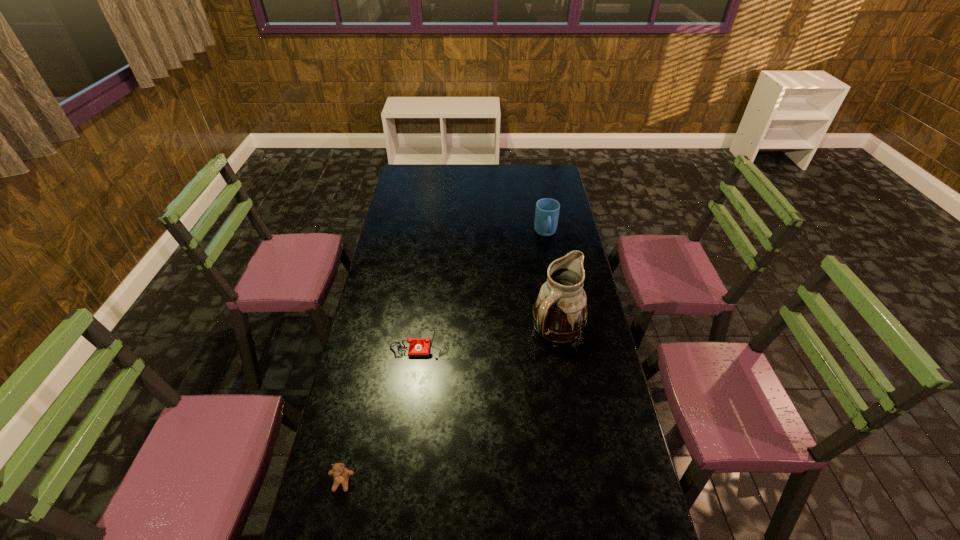
Image resolution: width=960 pixels, height=540 pixels. Find the location of `pitcher`. pitcher is located at coordinates (560, 312).

Locate an element on the screen. The image size is (960, 540). the second tallest object is located at coordinates (547, 210).

The width and height of the screenshot is (960, 540). I want to click on the farthest object, so click(x=547, y=210).

What are the coordinates of `teddy bear` in the screenshot? It's located at (341, 475).

You are a GUI agent. You are given a task and a screenshot of the screen. Output one action in this format:
    pyautogui.click(x=<x>, y=<y>)
    Task: Click on the leftmost object
    Image resolution: width=960 pixels, height=540 pixels.
    Given the screenshot: What is the action you would take?
    pyautogui.click(x=341, y=475)

Find the location of a particular element. This screenshot has height=540, width=960. telephone is located at coordinates (418, 347).

This screenshot has height=540, width=960. I want to click on the second object from left to right, so click(x=418, y=347).

What are the coordinates of `free region located from the spout of the tallest object` in the screenshot? It's located at (567, 384).

Find the location of a particular element. free space located 0.150m on the side of the second tallest object with the handle is located at coordinates (551, 265).

Identify the location of free location located on the front-facing side of the nearest object. (331, 532).